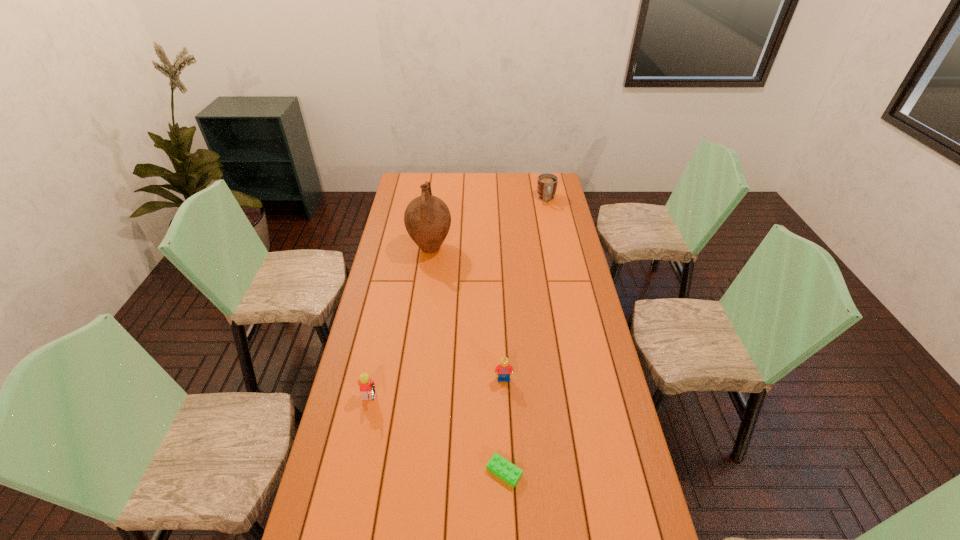
I want to click on vacant space located 0.320m in front of the fourth farthest object with the accessory visible, so click(477, 402).

You are a GUI agent. You are given a task and a screenshot of the screen. Output one action in this format:
    pyautogui.click(x=<x>, y=<y>)
    Task: Click on the free space located on the side of the farthest object with the handle
    
    Given the screenshot: What is the action you would take?
    pyautogui.click(x=554, y=237)

Where is `vacant region located 0.230m on the face of the farthest Lego`? This screenshot has width=960, height=540. vacant region located 0.230m on the face of the farthest Lego is located at coordinates (507, 449).

Find the location of a particular element. vacant point located 0.280m on the back of the nearest Lego is located at coordinates (500, 378).

Find the location of `object that is at the far edge`. object that is at the far edge is located at coordinates [x=547, y=183].

Identify the location of pitcher located in the left edge section of the desktop. 427,219.

At what (x,y) coordinates should I click in order to perform the action: click on Lego that is at the left edge. Please return your answer as a coordinate pair (x, y). Image resolution: width=960 pixels, height=540 pixels. Looking at the image, I should click on (367, 386).

Locate an element on the screen. The height and width of the screenshot is (540, 960). object at the right edge is located at coordinates (547, 183).

Locate an element on the screen. This screenshot has width=960, height=540. object positioned at the far right corner is located at coordinates (547, 183).

The height and width of the screenshot is (540, 960). I want to click on free space at the far edge of the desktop, so click(465, 188).